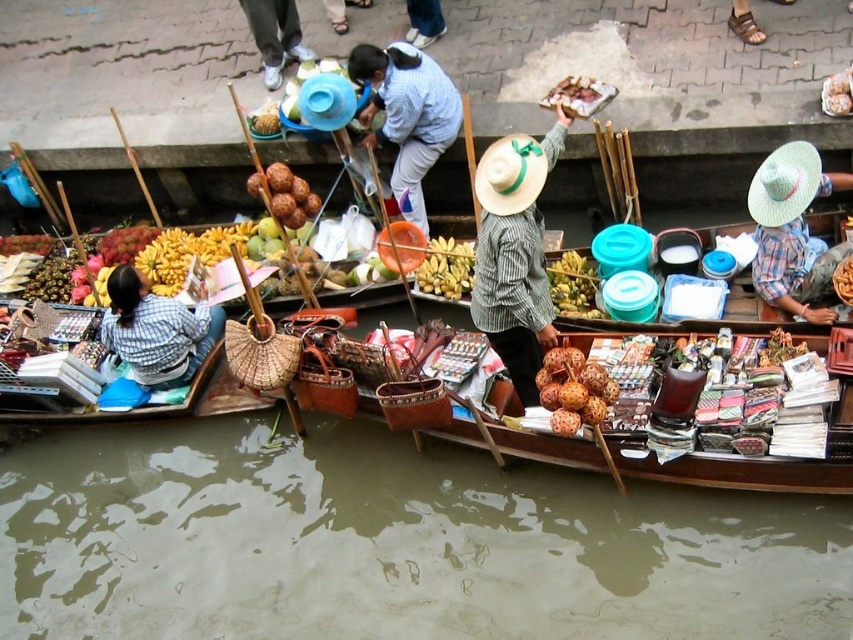
Is point (376, 496) less distant than point (791, 205)?

No, it is behind (791, 205).

From the picture: Who is lower down, brown murky water at lower center or plaid fabric hat at right?

brown murky water at lower center is below.

Measure the distance between brown murky water at lower center and camera.

brown murky water at lower center and camera are 5.85 meters apart.

I want to click on brown murky water at lower center, so click(x=390, y=544).

Is blue plaid shirt at lower left wider than shiny plastic container at upper center?

Result: Indeed, blue plaid shirt at lower left has a greater width compared to shiny plastic container at upper center.

Does point (131, 268) come in front of point (566, 81)?

Yes, point (131, 268) is in front of point (566, 81).

The image size is (853, 640). Find the location of `blue plaid shirt at lower left`. blue plaid shirt at lower left is located at coordinates (155, 330).

Which is more to the left, brown murky water at lower center or smooth brown nuts at center?

Positioned to the left is brown murky water at lower center.

Describe the element at coordinates (390, 544) in the screenshot. I see `brown murky water at lower center` at that location.

Find the location of a particular element. brown murky water at lower center is located at coordinates (390, 544).

This screenshot has width=853, height=640. Identify the location of brown murky water at lower center. (390, 544).